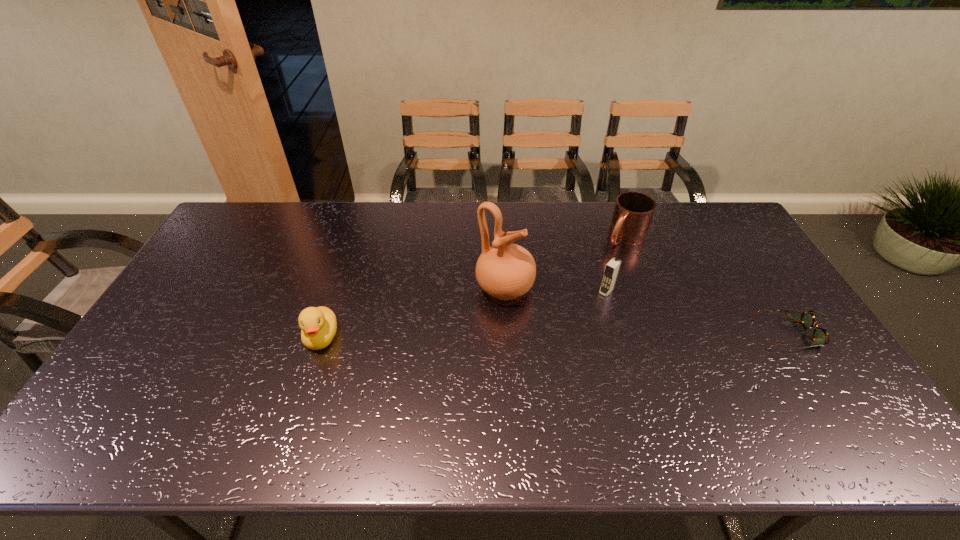
Identify the location of free location located on the front-facing side of the third object from left to right. The width and height of the screenshot is (960, 540). (583, 316).

Locate an element on the screen. The width and height of the screenshot is (960, 540). vacant space located on the front-facing side of the third object from left to right is located at coordinates (587, 312).

Locate an element on the screen. The height and width of the screenshot is (540, 960). object that is positioned at the far edge is located at coordinates (633, 211).

At what (x,y) coordinates should I click in order to perform the action: click on object present at the right edge. Please return your answer as a coordinate pair (x, y). The image size is (960, 540). Looking at the image, I should click on (821, 337).

You are a GUI agent. You are given a task and a screenshot of the screen. Output one action in this format:
    pyautogui.click(x=<x>, y=<y>)
    Task: Click on the free spot at the far edge of the desktop
    This screenshot has width=960, height=540.
    Given the screenshot: What is the action you would take?
    pyautogui.click(x=307, y=228)

Identify the location of vacant region at the left edge. (170, 322).

You are a GUI agent. You are given a task and a screenshot of the screen. Output one action in this format:
    pyautogui.click(x=<x>, y=<y>)
    Task: Click on the free space at the right edge
    
    Given the screenshot: What is the action you would take?
    coord(770,294)

Locate an element on the screen. This screenshot has width=960, height=540. vacant space at the far left corner is located at coordinates (255, 202).

I want to click on unoccupied position between the leftmost object and the third object from right to left, so click(464, 314).

Locate an element on the screen. This screenshot has width=960, height=540. blank region between the spectacles and the pottery is located at coordinates (650, 311).